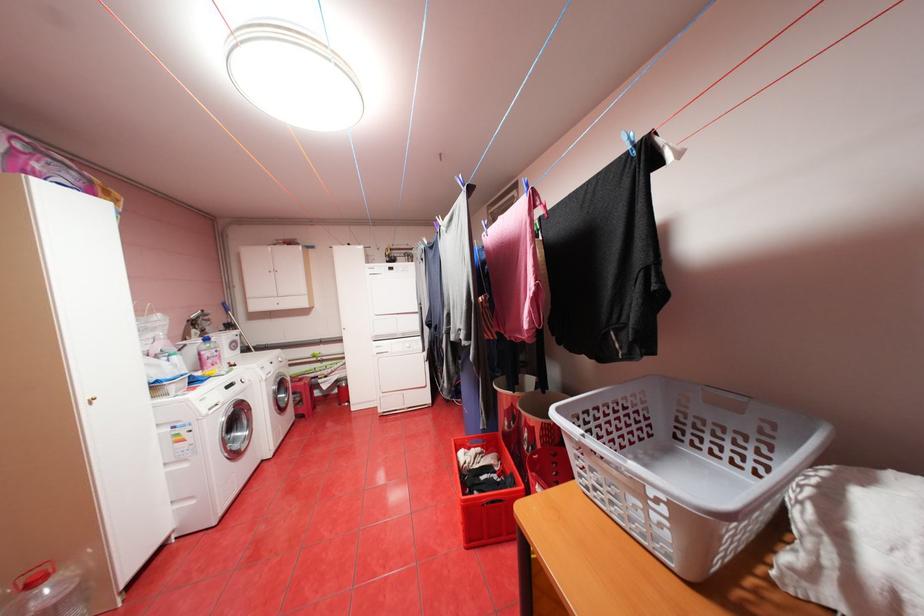
Where is `white cabinet knob`? white cabinet knob is located at coordinates (91, 400).